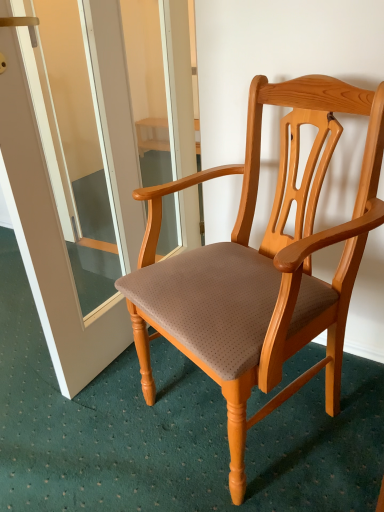
What is the approximate height of transparent glass screen door at center?

3.66 feet.

Find the location of a particular element. The image size is (384, 512). transparent glass screen door at center is located at coordinates (71, 186).

Image resolution: width=384 pixels, height=512 pixels. What do you see at coordinates (71, 186) in the screenshot?
I see `transparent glass screen door at center` at bounding box center [71, 186].

In order to face light brown wood chair at center, should I rotate leftwards or rightwards?

It's best to rotate right around 4.912 degrees.

This screenshot has height=512, width=384. What do you see at coordinates (259, 271) in the screenshot? I see `light brown wood chair at center` at bounding box center [259, 271].

Identify the location of light brown wood chair at center. The width and height of the screenshot is (384, 512). (259, 271).

Find the location of a particular element. The height and width of the screenshot is (512, 384). transparent glass screen door at center is located at coordinates (71, 186).

Which is more to the left, transparent glass screen door at center or light brown wood chair at center?

From the viewer's perspective, transparent glass screen door at center appears more on the left side.

Is transparent glass screen door at center positioned before light brown wood chair at center?

No, transparent glass screen door at center is behind light brown wood chair at center.

Which is in front, point (28, 172) or point (236, 319)?

The point (236, 319) is in front.

From the image's perspective, which one is positioned lower, transparent glass screen door at center or light brown wood chair at center?

light brown wood chair at center appears lower in the image.

From a real-world perspective, does transparent glass screen door at center stand above light brown wood chair at center?

Yes, from a real-world perspective, transparent glass screen door at center is above light brown wood chair at center.

Which of these two, transparent glass screen door at center or light brown wood chair at center, is wider?

light brown wood chair at center.

Who is shorter, transparent glass screen door at center or light brown wood chair at center?

light brown wood chair at center.

Can you confirm if transparent glass screen door at center is bigger than light brown wood chair at center?

No.

Would you say transparent glass screen door at center is outside light brown wood chair at center?

Yes, transparent glass screen door at center is not within light brown wood chair at center.

Would you say transparent glass screen door at center is a long distance from light brown wood chair at center?

No.

Is transparent glass screen door at center aimed at light brown wood chair at center?

Yes, transparent glass screen door at center is oriented towards light brown wood chair at center.

How much distance is there between transparent glass screen door at center and light brown wood chair at center?

20.16 inches.

Find the location of a particular element. This screenshot has width=384, height=512. chair in front of the transparent glass screen door at center is located at coordinates (259, 271).

Is light brown wood chair at center at the right side of transparent glass screen door at center?

Yes, light brown wood chair at center is to the right of transparent glass screen door at center.

Which is in front, light brown wood chair at center or transparent glass screen door at center?

Positioned in front is light brown wood chair at center.

Which is less distant, [307,333] or [67,338]?

The point [307,333] is in front.

From the image's perspective, relative to transparent glass screen door at center, is light brown wood chair at center above or below?

light brown wood chair at center is situated lower than transparent glass screen door at center in the image.

From a real-world perspective, is light brown wood chair at center above or below transparent glass screen door at center?

From a real-world perspective, light brown wood chair at center is physically below transparent glass screen door at center.

Which of these two, light brown wood chair at center or transparent glass screen door at center, is wider?

light brown wood chair at center is wider.

Does light brown wood chair at center have a lesser height compared to transparent glass screen door at center?

Correct, light brown wood chair at center is not as tall as transparent glass screen door at center.

Between light brown wood chair at center and transparent glass screen door at center, which one has smaller size?

Smaller between the two is transparent glass screen door at center.

Is light brown wood chair at center not within transparent glass screen door at center?

light brown wood chair at center is positioned outside transparent glass screen door at center.

Is the surface of light brown wood chair at center in direct contact with transparent glass screen door at center?

No, light brown wood chair at center is not next to transparent glass screen door at center.

Based on the photo, is light brown wood chair at center oriented away from transparent glass screen door at center?

light brown wood chair at center does not have its back to transparent glass screen door at center.

At what (x,y) coordinates should I click in order to perform the action: click on screen door on the left of the light brown wood chair at center. Please return your answer as a coordinate pair (x, y). Looking at the image, I should click on (71, 186).

Where is `chair that is under the transparent glass screen door at center (from a real-world perspective)`? The image size is (384, 512). chair that is under the transparent glass screen door at center (from a real-world perspective) is located at coordinates (259, 271).

I want to click on chair in front of the transparent glass screen door at center, so click(259, 271).